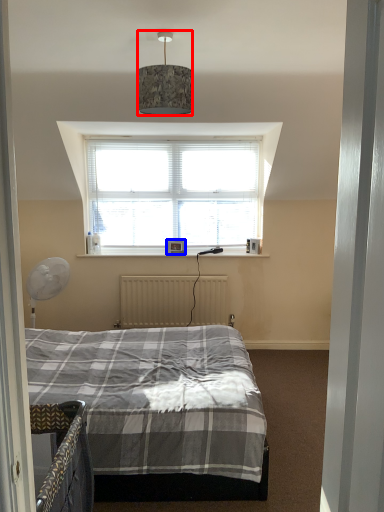
Question: Which object appears farthest to the camera in this image, lamp (highlighted by a red box) or picture frame (highlighted by a blue box)?

Choices:
 (A) lamp
 (B) picture frame

Answer: (B)